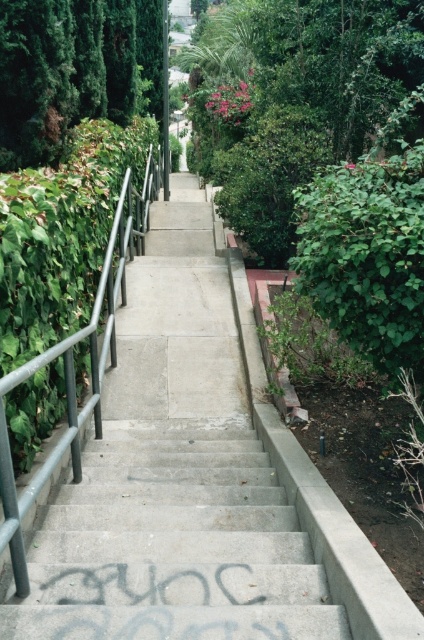
Question: Is concrete stairs at center above metallic gray railing at center?

Choices:
 (A) no
 (B) yes

Answer: (A)

Question: Which of the following is the farthest from the observer?

Choices:
 (A) concrete stairs at center
 (B) metallic gray railing at center

Answer: (B)

Question: Which of the following is the closest to the observer?

Choices:
 (A) metallic gray railing at center
 (B) concrete stairs at center

Answer: (B)

Question: Where is concrete stairs at center located in relation to metallic gray railing at center in the image?

Choices:
 (A) left
 (B) right

Answer: (B)

Question: Is concrete stairs at center thinner than metallic gray railing at center?

Choices:
 (A) no
 (B) yes

Answer: (A)